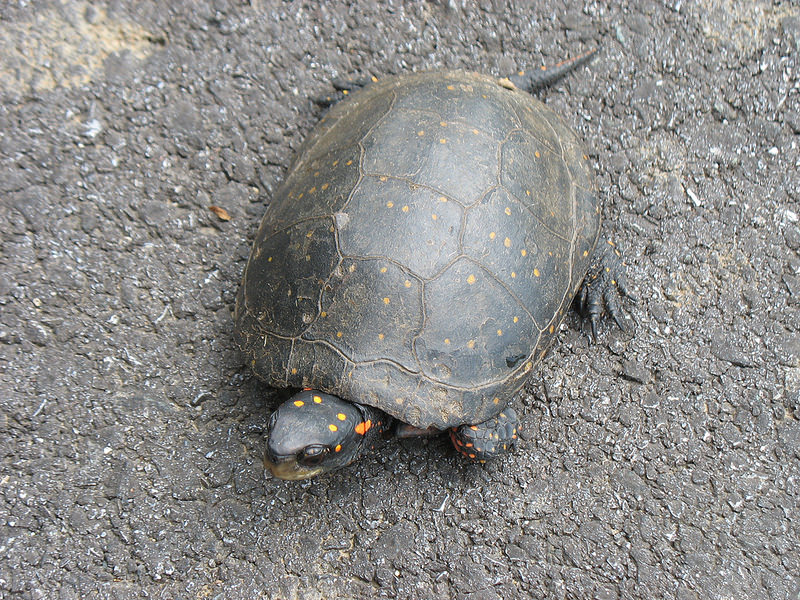
The width and height of the screenshot is (800, 600). In order to click on left front leg in this screenshot , I will do [484, 443].